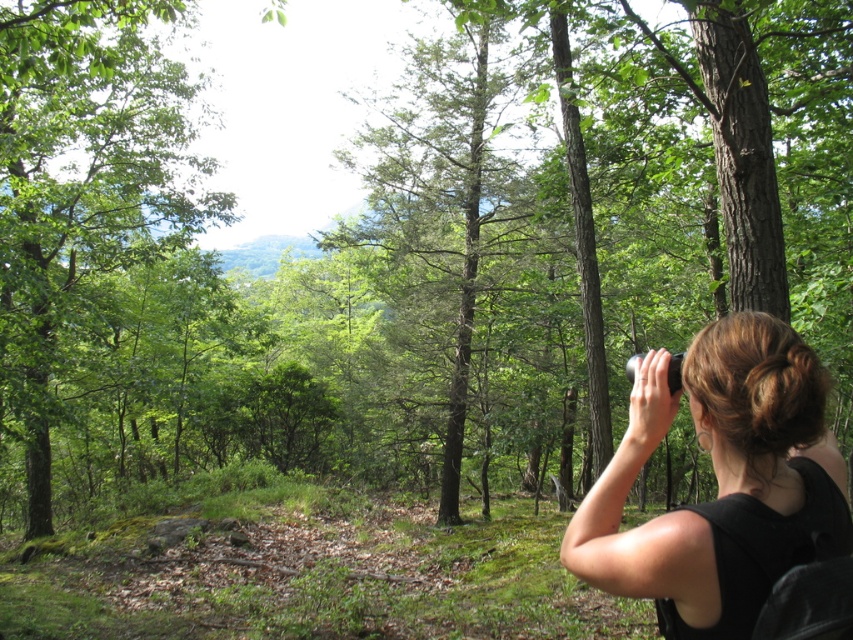
You are standing in the forest and see the black matte binoculars at center and the green matte tree at center. Which object is positioned to the right of the other?

The black matte binoculars at center are to the right of the green matte tree at center.

You are standing in the forest scene shown. There is a point marked at coordinates (82,186). What object is located at this point?

The point at coordinates (82,186) marks a green leafy tree at left.

You are standing in the forest scene and notice a point marked at coordinates (82, 186). What object is located at this point?

The point at coordinates (82, 186) indicates a green leafy tree at the left.